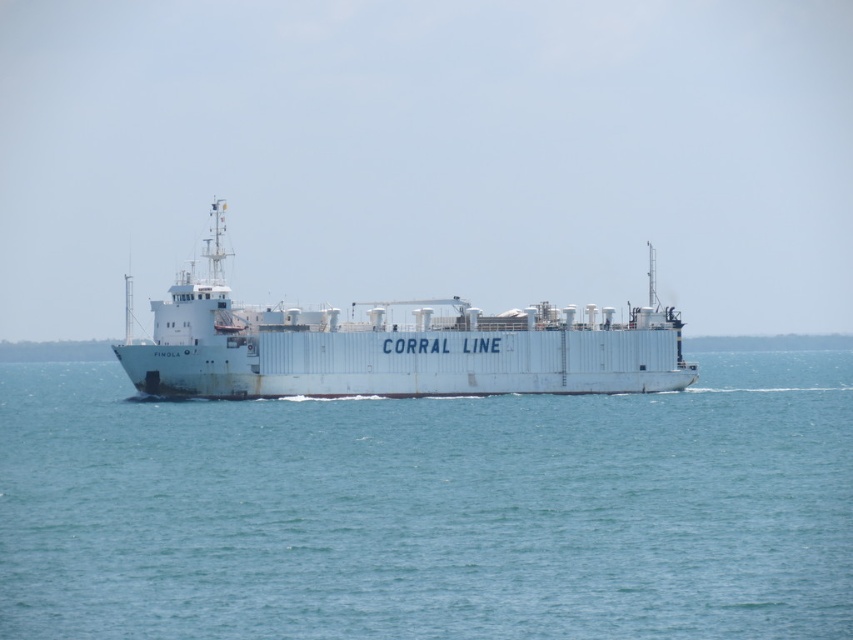
Question: Which point is closer to the camera?

Choices:
 (A) (416, 484)
 (B) (299, 396)

Answer: (A)

Question: Is blue water at center positioned before white matte ship at center?

Choices:
 (A) yes
 (B) no

Answer: (A)

Question: Which object is farther from the camera taking this photo?

Choices:
 (A) white matte ship at center
 (B) blue water at center

Answer: (A)

Question: Does blue water at center come in front of white matte ship at center?

Choices:
 (A) no
 (B) yes

Answer: (B)

Question: Which of the following is the farthest from the observer?

Choices:
 (A) (596, 358)
 (B) (761, 483)

Answer: (A)

Question: Can you confirm if blue water at center is positioned below white matte ship at center?

Choices:
 (A) yes
 (B) no

Answer: (A)